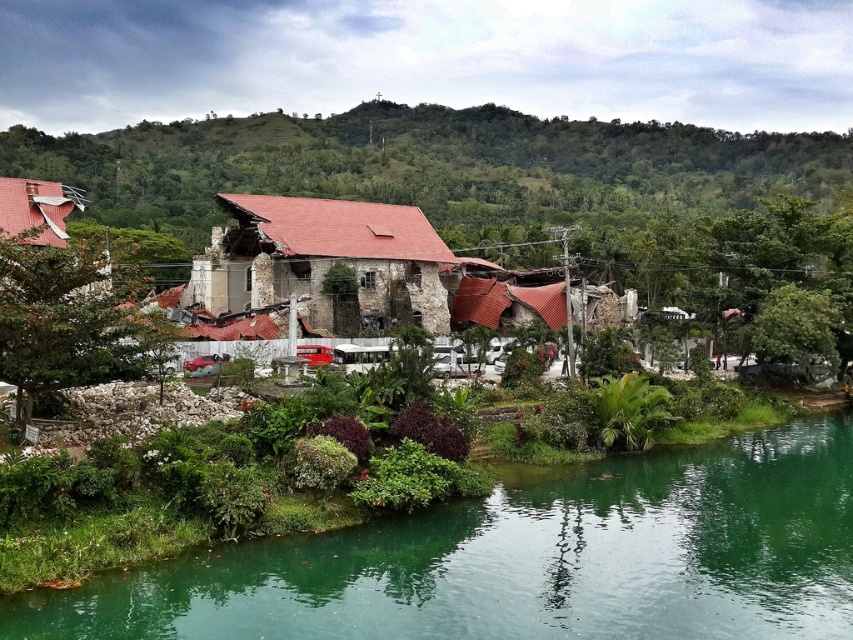
Is green smooth water at lower center taller than green leafy hillside at upper center?

No.

Between green smooth water at lower center and green leafy hillside at upper center, which one appears on the right side from the viewer's perspective?

green smooth water at lower center

This screenshot has width=853, height=640. I want to click on green smooth water at lower center, so click(x=527, y=560).

Does green leafy hillside at upper center come behind rusty metal hut at center?

Yes, green leafy hillside at upper center is behind rusty metal hut at center.

Measure the distance from green leafy hillside at upper center to rusty metal hut at center.

green leafy hillside at upper center and rusty metal hut at center are 250.32 feet apart from each other.

Which is in front, point (537, 250) or point (270, 243)?

Point (270, 243) is more forward.

The width and height of the screenshot is (853, 640). I want to click on green leafy hillside at upper center, so click(x=431, y=168).

Does green smooth water at lower center have a smaller size compared to rusty metal hut at center?

Yes.

Is point (616, 528) in front of point (413, 307)?

Yes, it is in front of point (413, 307).

Is point (396, 529) closer to viewer compared to point (433, 289)?

That is True.

I want to click on green smooth water at lower center, so click(527, 560).